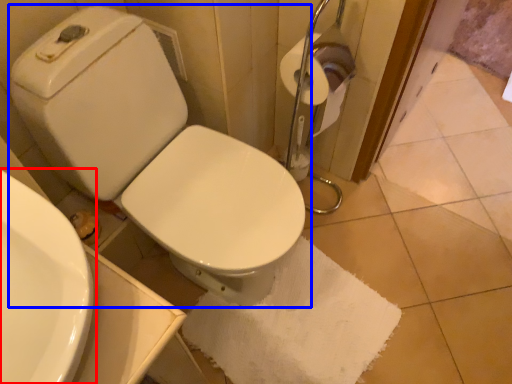
Question: Which object is further to the camera taking this photo, sink (highlighted by a red box) or toilet (highlighted by a blue box)?

Choices:
 (A) sink
 (B) toilet

Answer: (B)